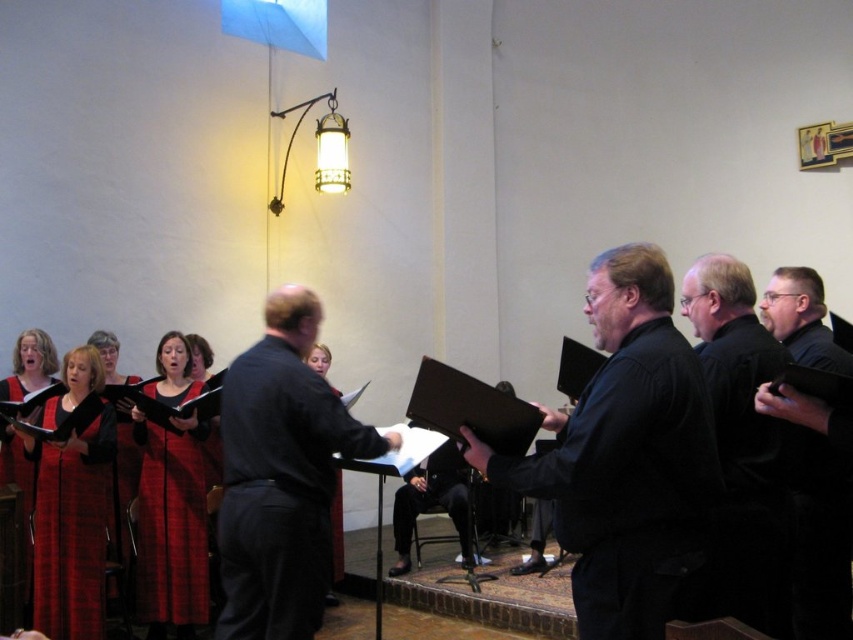
You are a photographer standing at the front of the choir performance venue. You want to take a photo of both points mentioned in the scene. Which point, point (730, 576) or point (848, 518), will appear larger in your photo?

Point (730, 576) will appear larger in the photo because it is closer to the camera than point (848, 518).